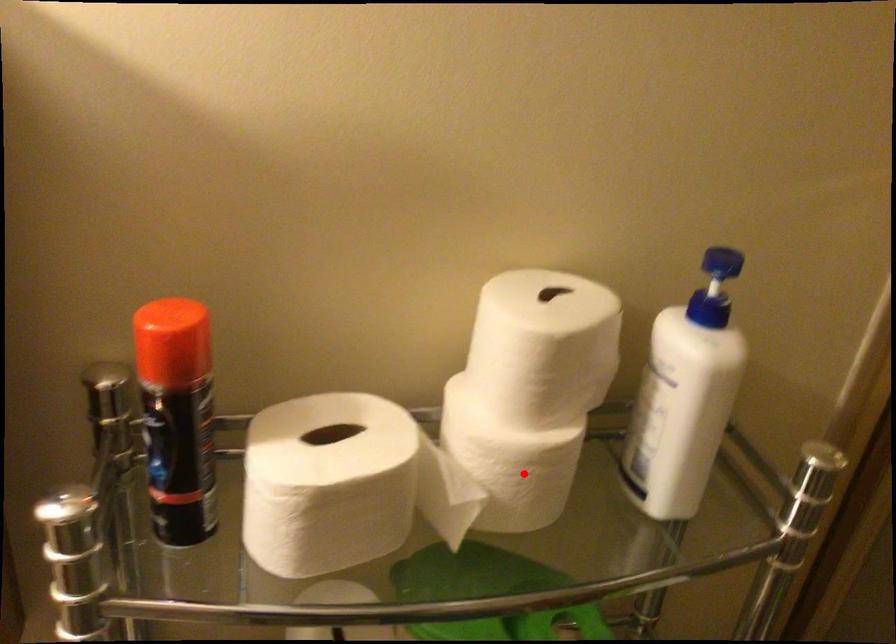
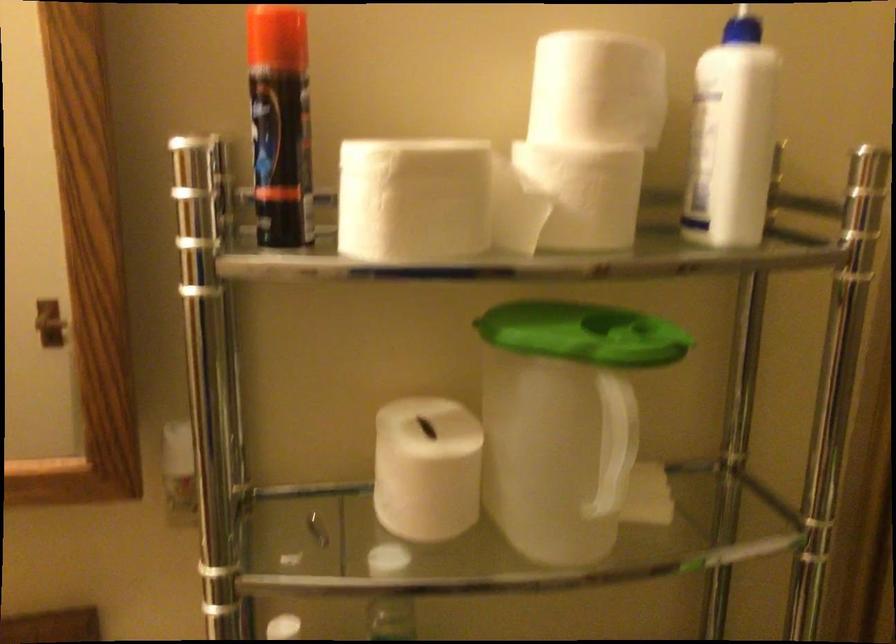
Question: I am providing you with two images of the same scene from different viewpoints. A red point is marked on the first image. At the location where the point appears in image 1, is it still visible in image 2?

Choices:
 (A) Yes
 (B) No

Answer: (A)